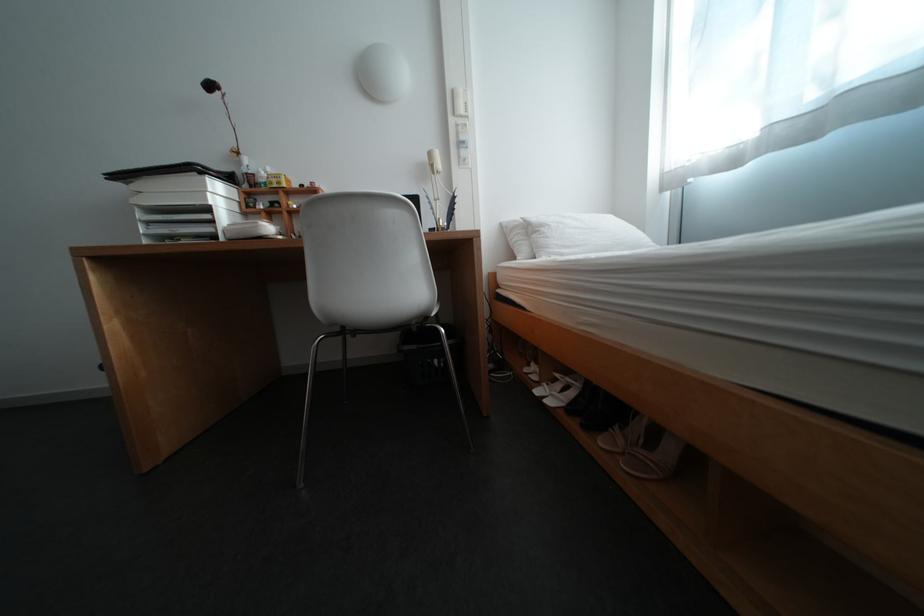
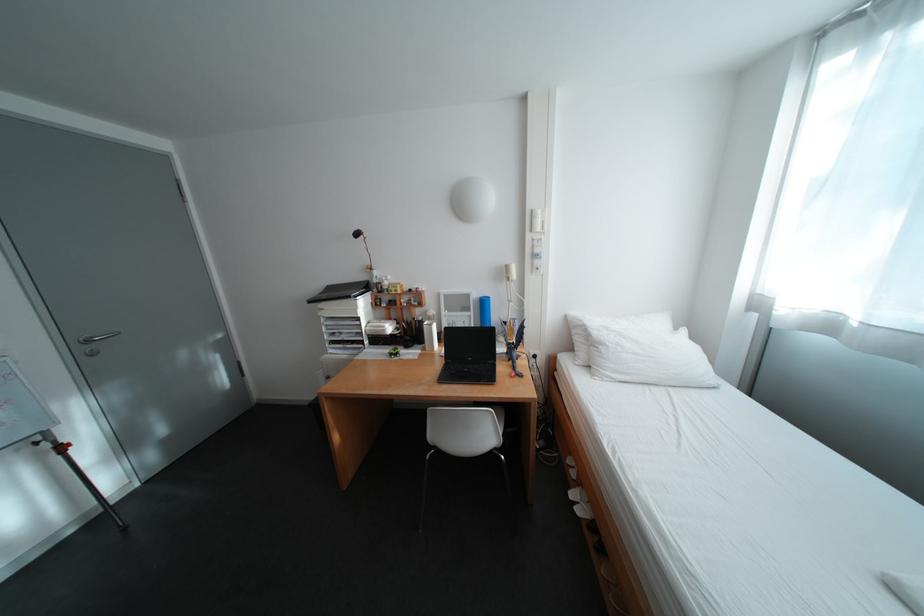
Where in the second image is the point corresponding to pixel 555 228 from the first image?

(614, 346)